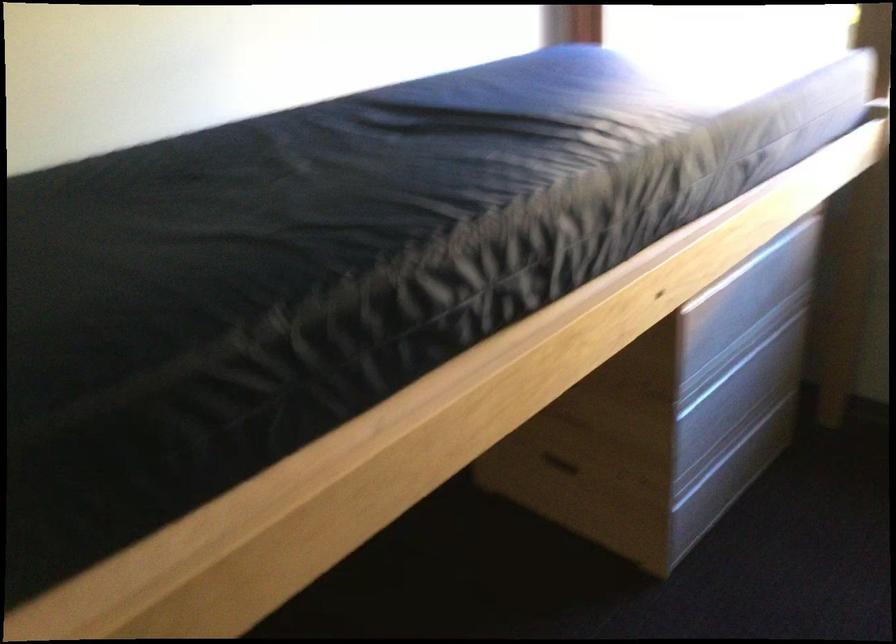
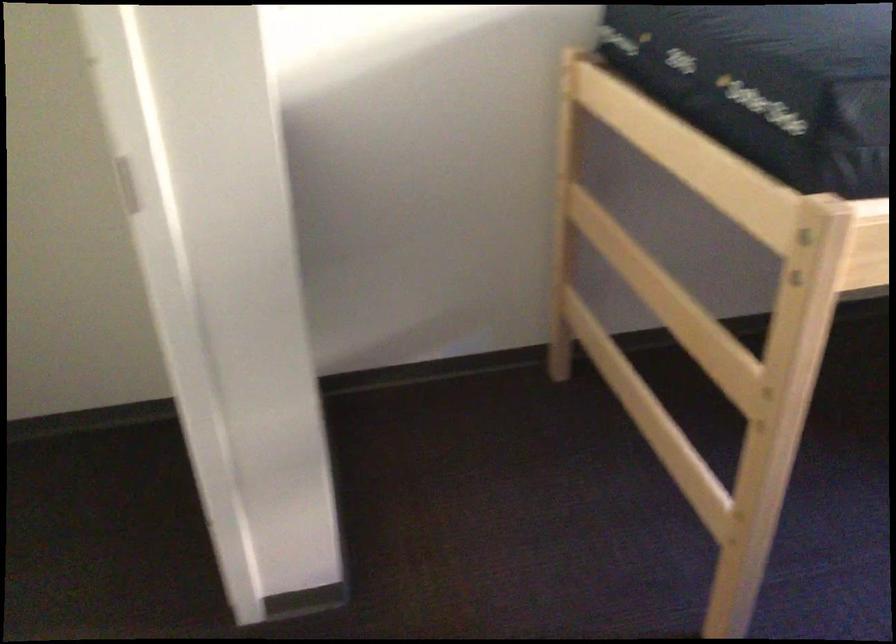
Question: The images are taken continuously from a first-person perspective. In which direction is your viewpoint rotating?

Choices:
 (A) Left
 (B) Right
 (C) Up
 (D) Down

Answer: (A)